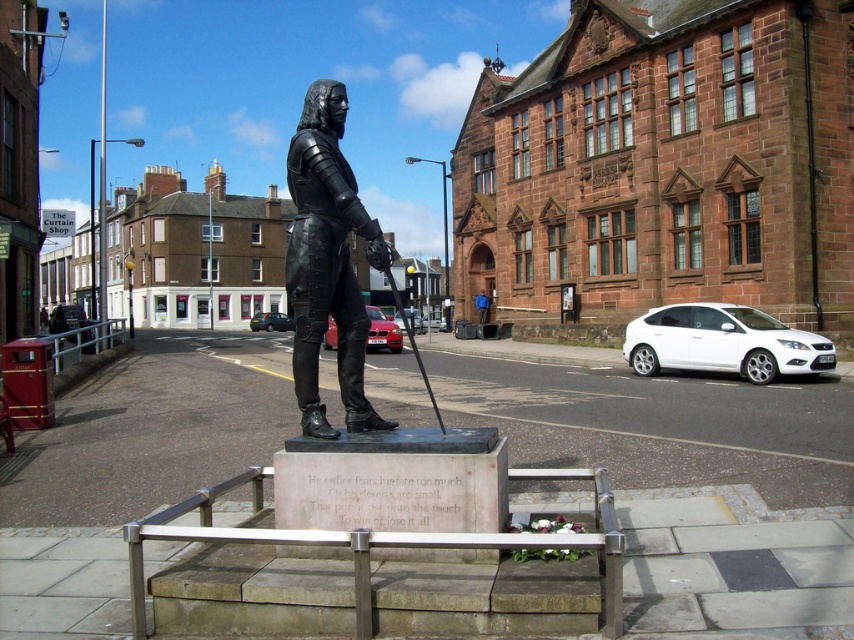
You are a photographer standing in the town square and want to take a photo of the black polished bronze statue at center. The statue is 4.86 meters away from you. Your camera has a maximum focus range of 5 meters. Will the camera be able to focus on the statue?

The black polished bronze statue at center is 4.86 meters from camera. Since the statue is within the camera maximum focus range of 5 meters, the camera will be able to focus on the statue.

You are a townsperson walking through the square and notice the black polished bronze statue at center and the blue fabric jacket at center. Which object is placed higher up?

The black polished bronze statue at center is positioned over the blue fabric jacket at center, so the statue is higher up.